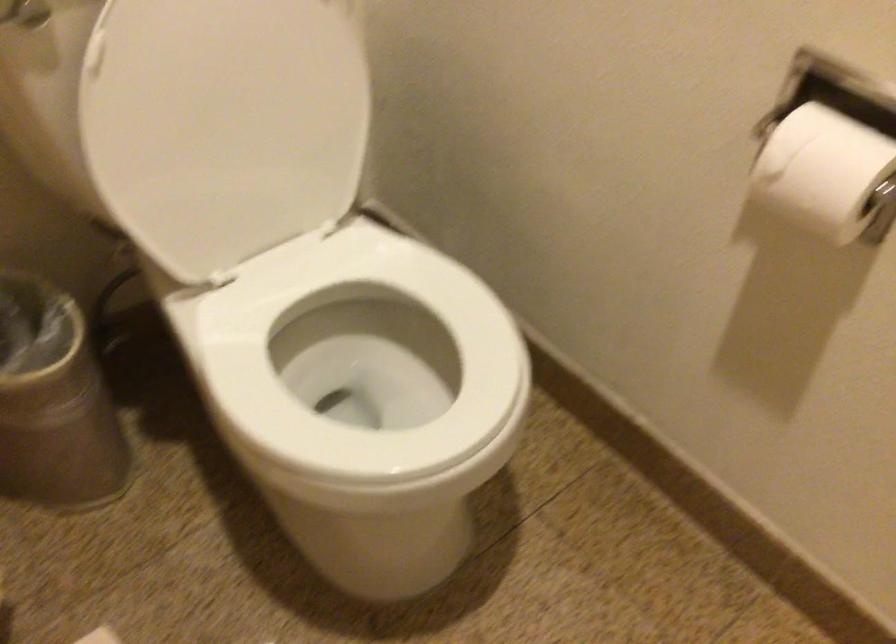
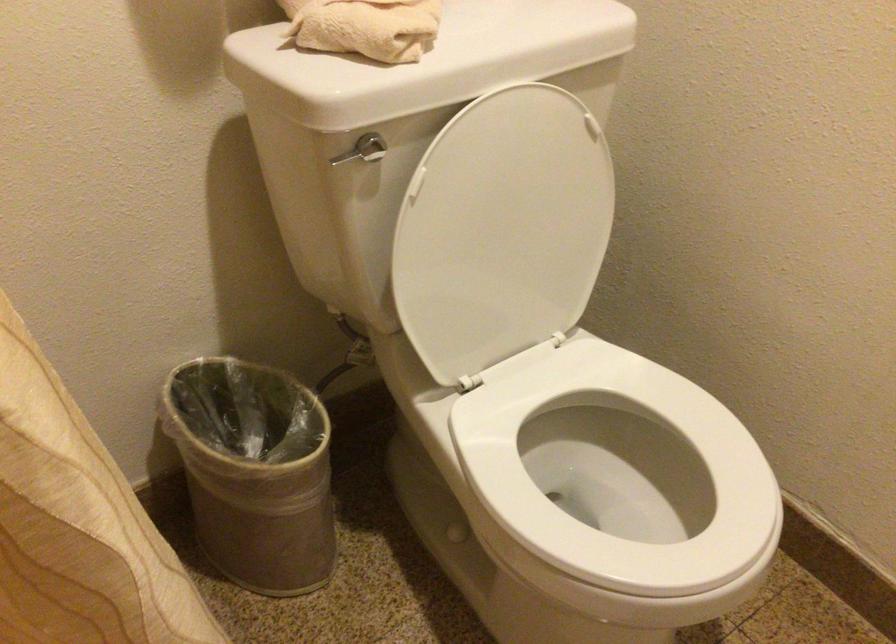
In the second image, find the point that corresponds to the point at 231,109 in the first image.

(502, 230)